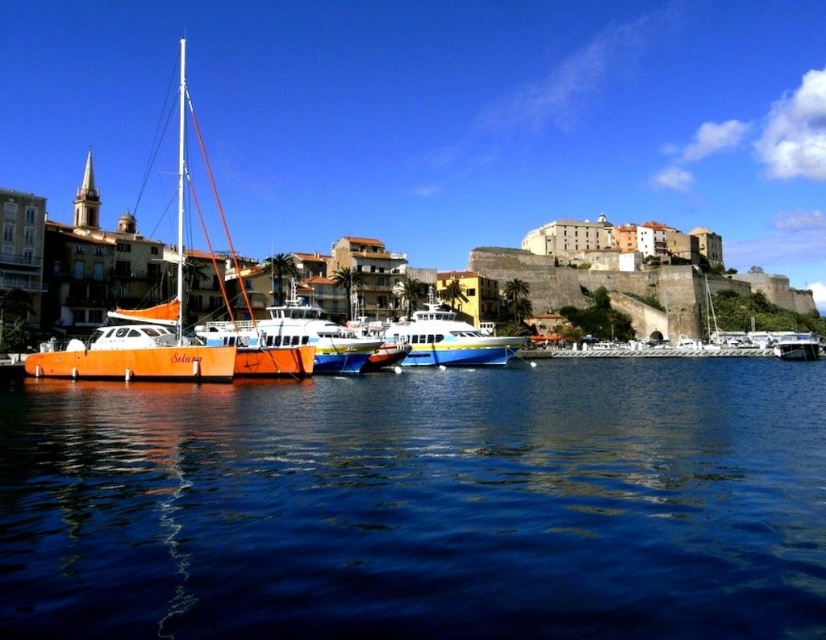
You are a photographer standing at the edge of the harbor. You want to capture a photo where the blue liquid water at lower center and the blue glossy boat at center are both visible. Based on their heights, which object will appear lower in the photo?

The blue liquid water at lower center has a lesser height compared to the blue glossy boat at center, so it will appear lower in the photo.